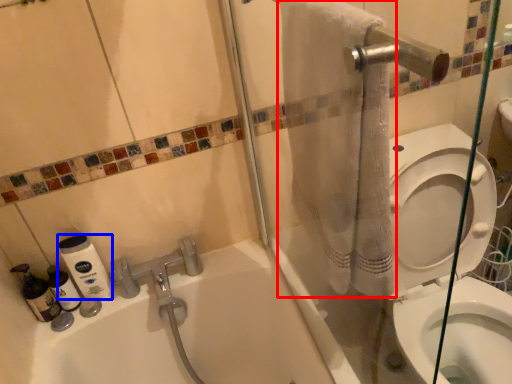
Question: Among these objects, which one is farthest to the camera, bath towel (highlighted by a red box) or cleaning product (highlighted by a blue box)?

Choices:
 (A) bath towel
 (B) cleaning product

Answer: (B)